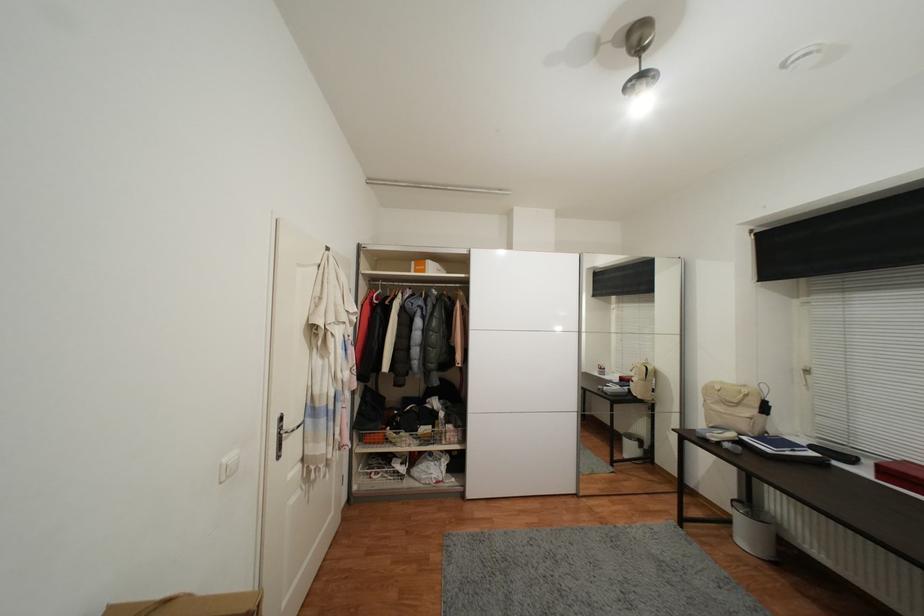
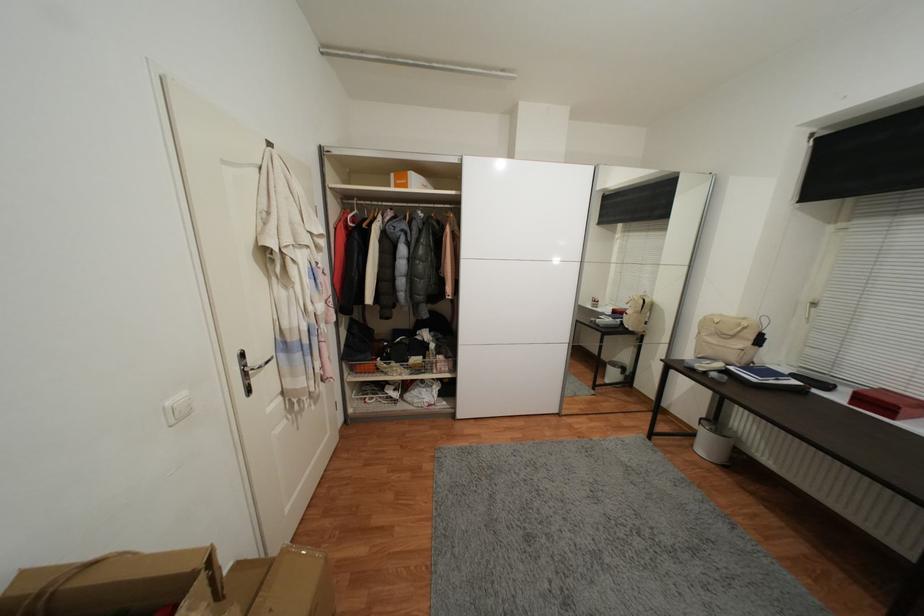
Find the pixel in the second image that matches point 419,273 in the first image.

(400, 188)